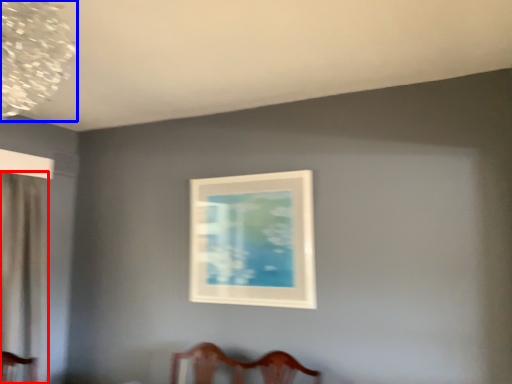
Question: Which point is closer to the camera, curtain (highlighted by a red box) or lamp (highlighted by a blue box)?

Choices:
 (A) curtain
 (B) lamp

Answer: (B)